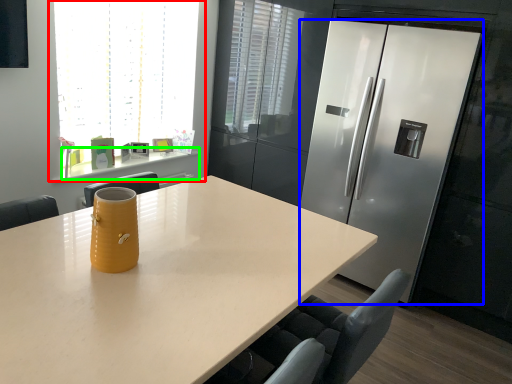
Question: Which object is the farthest from window (highlighted by a red box)? Choose among these: refrigerator (highlighted by a blue box) or counter (highlighted by a green box).

Choices:
 (A) refrigerator
 (B) counter

Answer: (A)